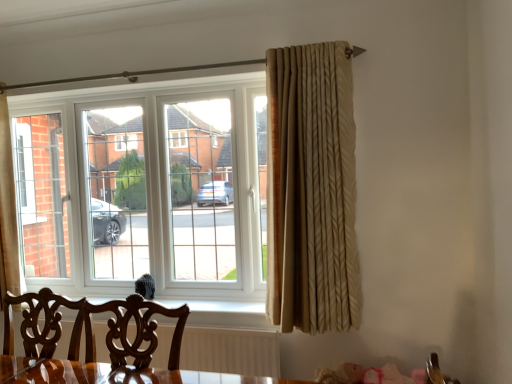
Question: Is the depth of beige textured curtain at right greater than that of mahogany wood swivel chair at lower left?

Choices:
 (A) yes
 (B) no

Answer: (A)

Question: Is beige textured curtain at right not close to mahogany wood swivel chair at lower left?

Choices:
 (A) yes
 (B) no

Answer: (A)

Question: Is mahogany wood swivel chair at lower left inside beige textured curtain at right?

Choices:
 (A) no
 (B) yes

Answer: (A)

Question: From a real-world perspective, is beige textured curtain at right over mahogany wood swivel chair at lower left?

Choices:
 (A) no
 (B) yes

Answer: (B)

Question: From a real-world perspective, is beige textured curtain at right located beneath mahogany wood swivel chair at lower left?

Choices:
 (A) yes
 (B) no

Answer: (B)

Question: In the image, is mahogany wood swivel chair at lower left on the left side or the right side of beige textured curtain at right?

Choices:
 (A) left
 (B) right

Answer: (A)

Question: From a real-world perspective, relative to beige textured curtain at right, is mahogany wood swivel chair at lower left vertically above or below?

Choices:
 (A) below
 (B) above

Answer: (A)

Question: Relative to beige textured curtain at right, is mahogany wood swivel chair at lower left in front or behind?

Choices:
 (A) behind
 (B) front

Answer: (B)

Question: Does point (72, 359) appear closer or farther from the camera than point (345, 57)?

Choices:
 (A) closer
 (B) farther

Answer: (A)

Question: Looking at their shapes, would you say mahogany wood swivel chair at lower left is wider or thinner than mahogany wood chair at lower center?

Choices:
 (A) wide
 (B) thin

Answer: (B)

Question: Is mahogany wood swivel chair at lower left to the left or to the right of mahogany wood chair at lower center in the image?

Choices:
 (A) left
 (B) right

Answer: (A)

Question: Considering the positions of point (90, 352) and point (132, 349), is point (90, 352) closer or farther from the camera than point (132, 349)?

Choices:
 (A) closer
 (B) farther

Answer: (B)

Question: From the image's perspective, is mahogany wood swivel chair at lower left located above or below mahogany wood chair at lower center?

Choices:
 (A) above
 (B) below

Answer: (B)

Question: Is point (292, 147) positioned closer to the camera than point (201, 274)?

Choices:
 (A) farther
 (B) closer

Answer: (B)

Question: Considering their positions, is beige textured curtain at right located in front of or behind white plastic window at center?

Choices:
 (A) front
 (B) behind

Answer: (A)